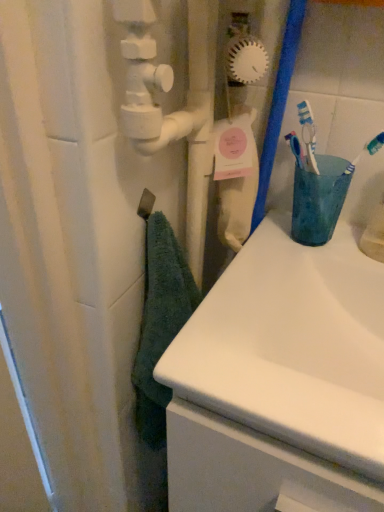
I want to click on free space in front of matte plastic cup at right, so click(x=284, y=279).